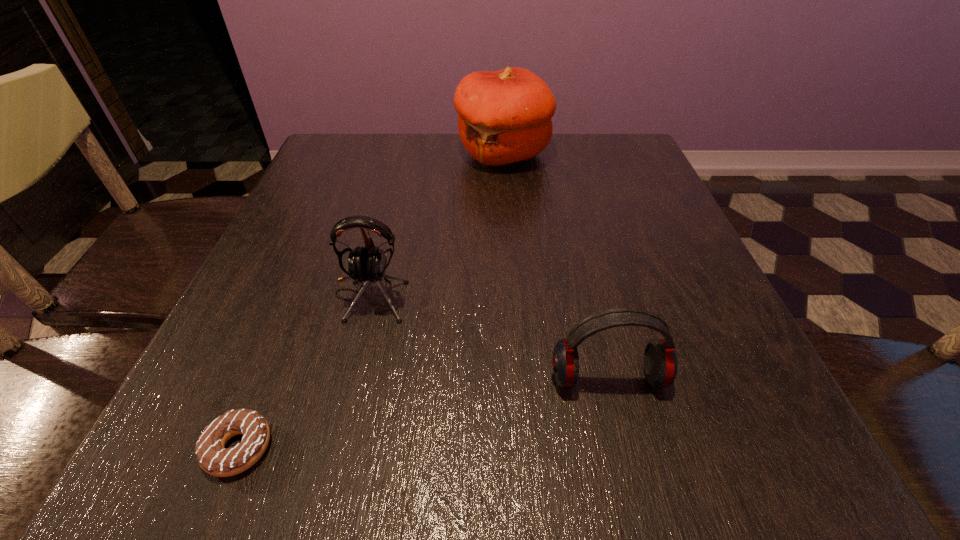
In the image, there is a desktop. At what (x,y) coordinates should I click in order to perform the action: click on vacant space at the right edge. Please return your answer as a coordinate pair (x, y). Looking at the image, I should click on (660, 227).

Locate an element on the screen. Image resolution: width=960 pixels, height=540 pixels. vacant region at the far left corner is located at coordinates (317, 167).

Locate an element on the screen. Image resolution: width=960 pixels, height=540 pixels. vacant space at the far right corner is located at coordinates (588, 172).

This screenshot has width=960, height=540. In the image, there is a desktop. What are the coordinates of `vacant space at the near right corner` in the screenshot? It's located at (667, 423).

Identify the location of unoccupied area between the pumpkin and the farther earphone. (436, 225).

This screenshot has height=540, width=960. I want to click on vacant point located between the doughnut and the third farthest object, so click(423, 413).

Identify the location of free space that is in between the leftmost object and the third object from right to left. (304, 372).

Locate an element on the screen. The image size is (960, 540). free space between the farthest object and the left earphone is located at coordinates (436, 225).

Where is `vacant region between the pumpkin and the right earphone`? The image size is (960, 540). vacant region between the pumpkin and the right earphone is located at coordinates (556, 266).

You are a GUI agent. You are given a task and a screenshot of the screen. Output one action in this format:
    pyautogui.click(x=<x>, y=<y>)
    Task: Click on the free space between the third farthest object and the farthest object
    The image size is (960, 540).
    Given the screenshot: What is the action you would take?
    pyautogui.click(x=556, y=266)